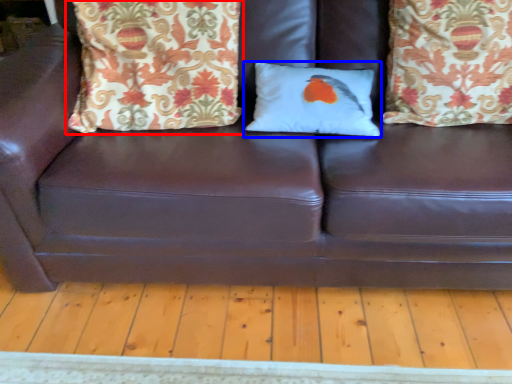
Question: Which object is further to the camera taking this photo, pillow (highlighted by a red box) or pillow (highlighted by a blue box)?

Choices:
 (A) pillow
 (B) pillow

Answer: (B)